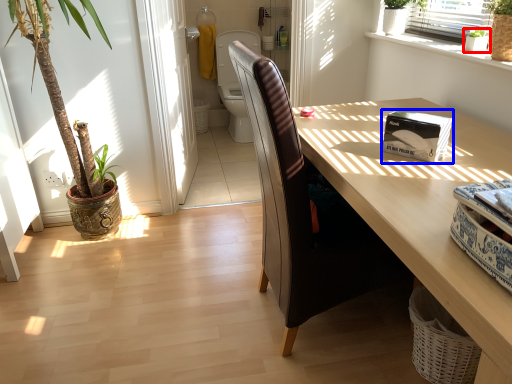
Question: Which object appears closest to the camera in this image, houseplant (highlighted by a red box) or box (highlighted by a blue box)?

Choices:
 (A) houseplant
 (B) box

Answer: (B)